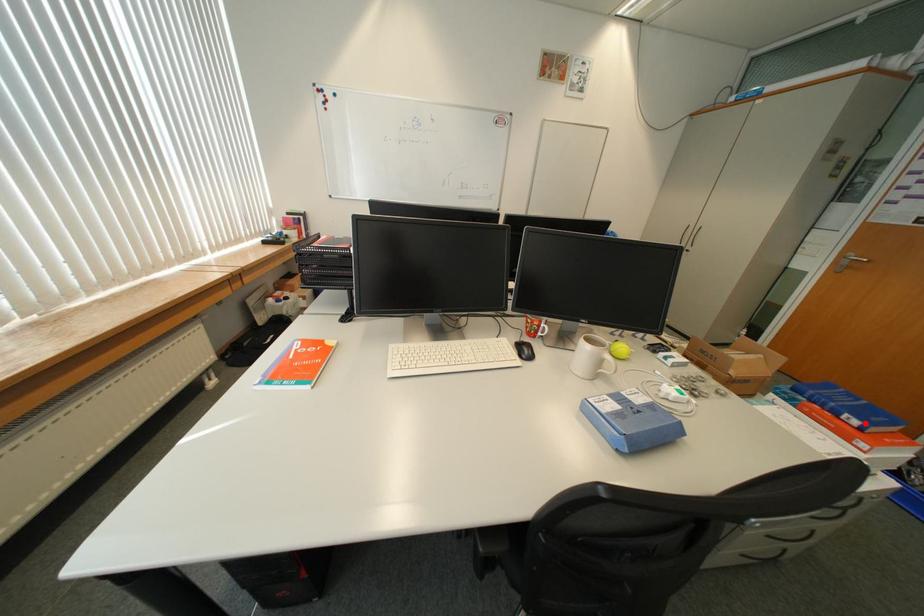
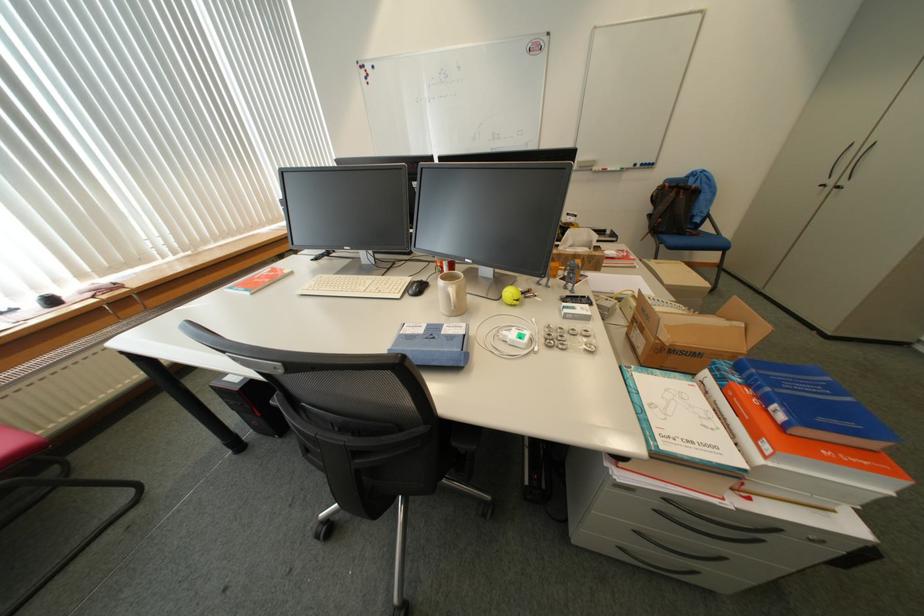
Question: A red point is marked in image1. In image2, is the corresponding 3D point closer to the camera or farther? Reply with the corresponding letter.

Choices:
 (A) The corresponding 3D point is closer.
 (B) The corresponding 3D point is farther.

Answer: (B)